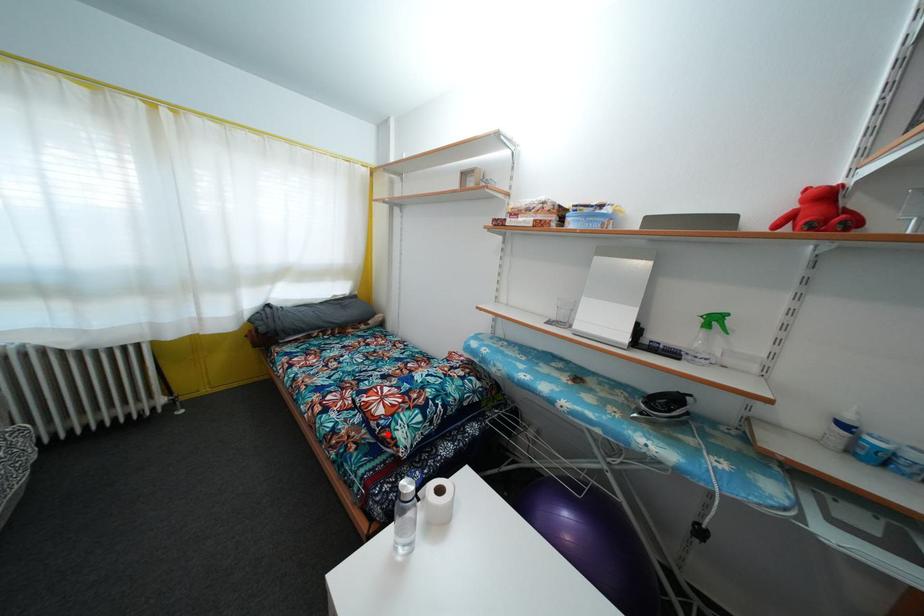
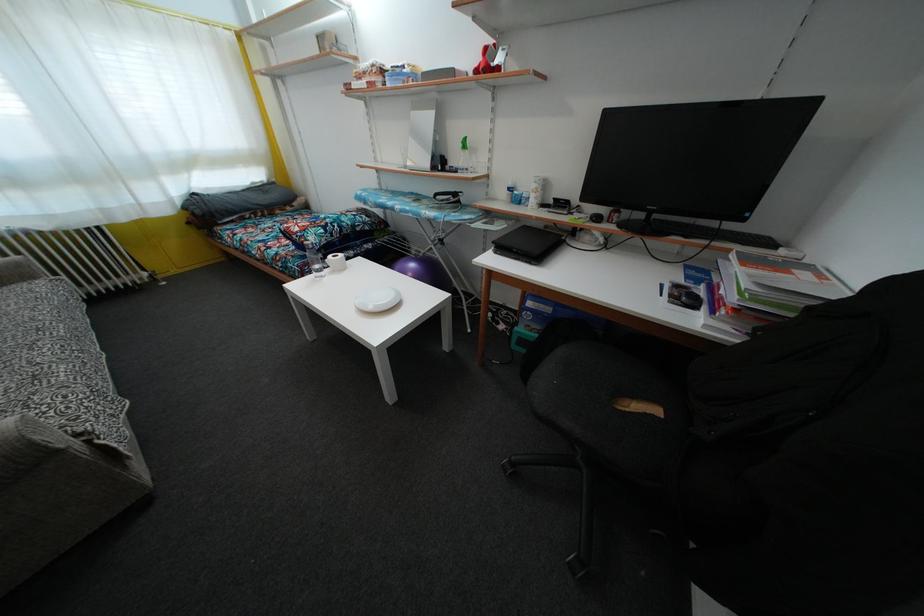
In the second image, find the point that corresponds to the highlighted location in the first image.

(305, 244)